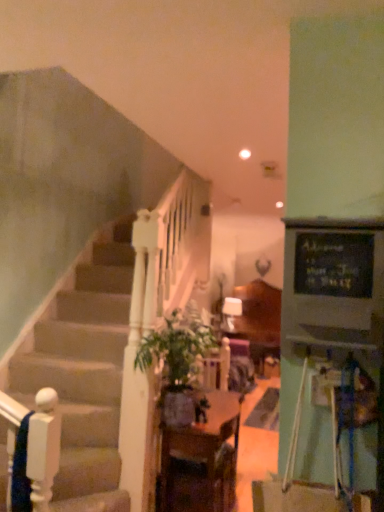
Find the location of a particular element. This screenshot has height=512, width=384. green leafy plant at center is located at coordinates (178, 366).

The width and height of the screenshot is (384, 512). What do you see at coordinates (178, 366) in the screenshot?
I see `green leafy plant at center` at bounding box center [178, 366].

Measure the distance between point (171, 319) and camera.

The depth of point (171, 319) is 9.11 feet.

The image size is (384, 512). Describe the element at coordinates (201, 460) in the screenshot. I see `wooden table at center` at that location.

The image size is (384, 512). In order to click on wooden table at center in this screenshot , I will do `click(201, 460)`.

At what (x,y) coordinates should I click in order to perform the action: click on green leafy plant at center. Please return your answer as a coordinate pair (x, y). Looking at the image, I should click on (178, 366).

Which is more to the right, green leafy plant at center or wooden table at center?

From the viewer's perspective, wooden table at center appears more on the right side.

In the scene shown: Does green leafy plant at center lie in front of wooden table at center?

Yes, it is in front of wooden table at center.

Is point (168, 388) farther from camera compared to point (202, 451)?

Yes, it is.

From the image's perspective, does green leafy plant at center appear higher than wooden table at center?

Indeed, from the image's perspective, green leafy plant at center is shown above wooden table at center.

From a real-world perspective, between green leafy plant at center and wooden table at center, who is vertically higher?

green leafy plant at center.

Can you confirm if green leafy plant at center is thinner than wooden table at center?

In fact, green leafy plant at center might be wider than wooden table at center.

Which of these two, green leafy plant at center or wooden table at center, stands shorter?

green leafy plant at center.

In terms of size, does green leafy plant at center appear bigger or smaller than wooden table at center?

Considering their sizes, green leafy plant at center takes up less space than wooden table at center.

Looking at this image, could wooden table at center be considered to be inside green leafy plant at center?

No, wooden table at center is not a part of green leafy plant at center.

Is green leafy plant at center positioned far away from wooden table at center?

No, green leafy plant at center is not far from wooden table at center.

Is wooden table at center at the back of green leafy plant at center?

green leafy plant at center does not have its back to wooden table at center.

How different are the orientations of green leafy plant at center and wooden table at center in degrees?

The angular difference between green leafy plant at center and wooden table at center is 0.000648 degrees.

Identify the location of table directly beneath the green leafy plant at center (from a real-world perspective). (201, 460).

Which object is positioned more to the left, wooden table at center or green leafy plant at center?

green leafy plant at center.

Between wooden table at center and green leafy plant at center, which one is positioned in front?

green leafy plant at center is closer to the camera.

Which point is more distant from viewer, (200, 461) or (198, 340)?

Point (200, 461)

From the image's perspective, would you say wooden table at center is shown under green leafy plant at center?

Yes.

From a real-world perspective, is wooden table at center physically located above or below green leafy plant at center?

From a real-world perspective, wooden table at center is physically below green leafy plant at center.

Looking at their sizes, would you say wooden table at center is wider or thinner than green leafy plant at center?

Clearly, wooden table at center has less width compared to green leafy plant at center.

Considering the sizes of wooden table at center and green leafy plant at center in the image, is wooden table at center taller or shorter than green leafy plant at center?

In the image, wooden table at center appears to be taller than green leafy plant at center.

Is wooden table at center bigger than green leafy plant at center?

Yes, wooden table at center is bigger than green leafy plant at center.

Is wooden table at center spatially inside green leafy plant at center, or outside of it?

wooden table at center is outside green leafy plant at center.

Is wooden table at center placed right next to green leafy plant at center?

No, wooden table at center is not beside green leafy plant at center.

Is wooden table at center aimed at green leafy plant at center?

No, wooden table at center is not oriented towards green leafy plant at center.

What's the angular difference between wooden table at center and green leafy plant at center's facing directions?

The facing directions of wooden table at center and green leafy plant at center are 0.000648 degrees apart.

How distant is wooden table at center from green leafy plant at center?

The distance of wooden table at center from green leafy plant at center is 33.33 centimeters.

Image resolution: width=384 pixels, height=512 pixels. Find the location of `houseplant in front of the wooden table at center`. houseplant in front of the wooden table at center is located at coordinates (178, 366).

You are a GUI agent. You are given a task and a screenshot of the screen. Output one action in this format:
    pyautogui.click(x=<x>, y=<y>)
    Task: Click on the houseplant in front of the wooden table at center
    The width and height of the screenshot is (384, 512).
    Given the screenshot: What is the action you would take?
    pyautogui.click(x=178, y=366)

Locate an element on the screen. The image size is (384, 512). table that is on the right side of green leafy plant at center is located at coordinates (201, 460).